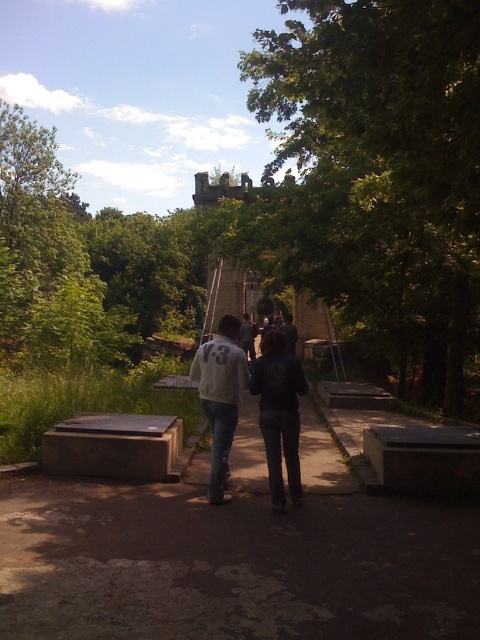
You are a photographer positioned at the starting point of the path. You want to capture both the white matte jacket at center and the dark gray hoodie at center in a single frame. Given that your camera has a fixed focal length and limited depth of field, which subject should you focus on to ensure the other remains in acceptable focus?

You should focus on the white matte jacket at center because it is closer to the camera than the dark gray hoodie at center, which is behind it. By focusing on the closer subject, the depth of field will extend backward, keeping both subjects acceptably sharp.

You are a photographer standing at the starting point of the pathway. You want to capture a photo of both the white matte jacket at center and the dark gray hoodie at center in the same frame. Based on their positions, which one will appear closer to the bottom of the photo?

The white matte jacket at center is positioned under the dark gray hoodie at center, so in the photo, the white matte jacket at center will appear closer to the bottom of the photo.